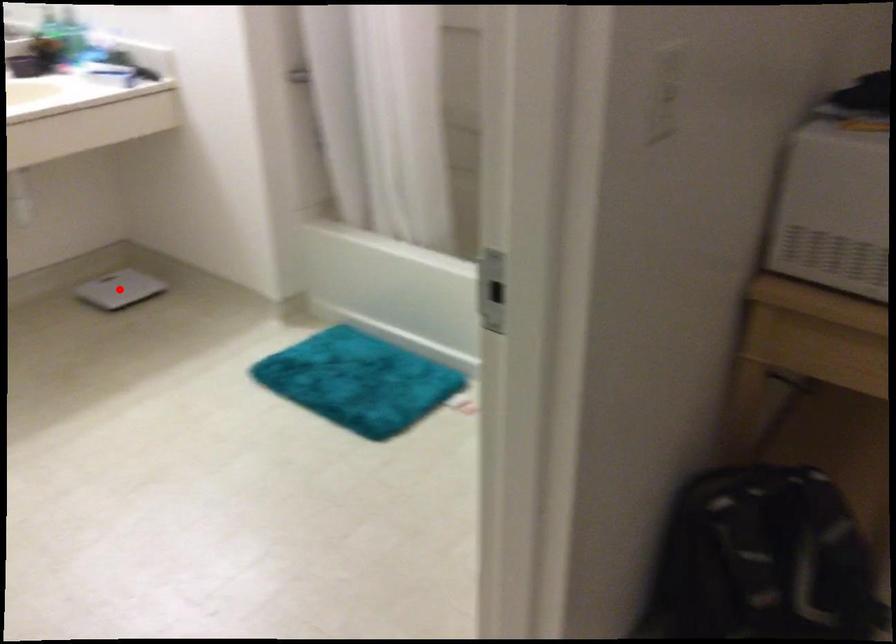
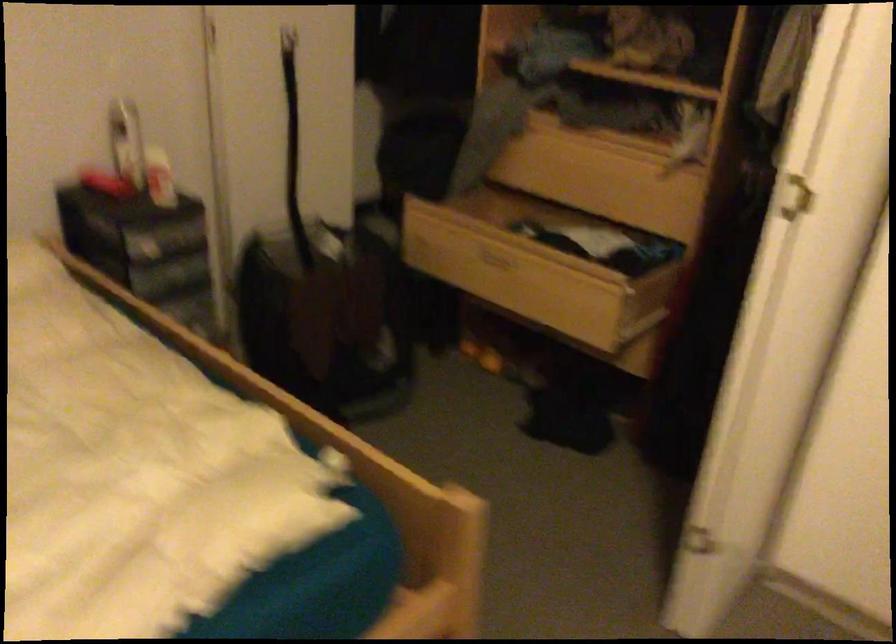
Question: I am providing you with two images of the same scene from different viewpoints. A red point is marked on the first image. At the location where the point appears in image 1, is it still visible in image 2?

Choices:
 (A) Yes
 (B) No

Answer: (B)